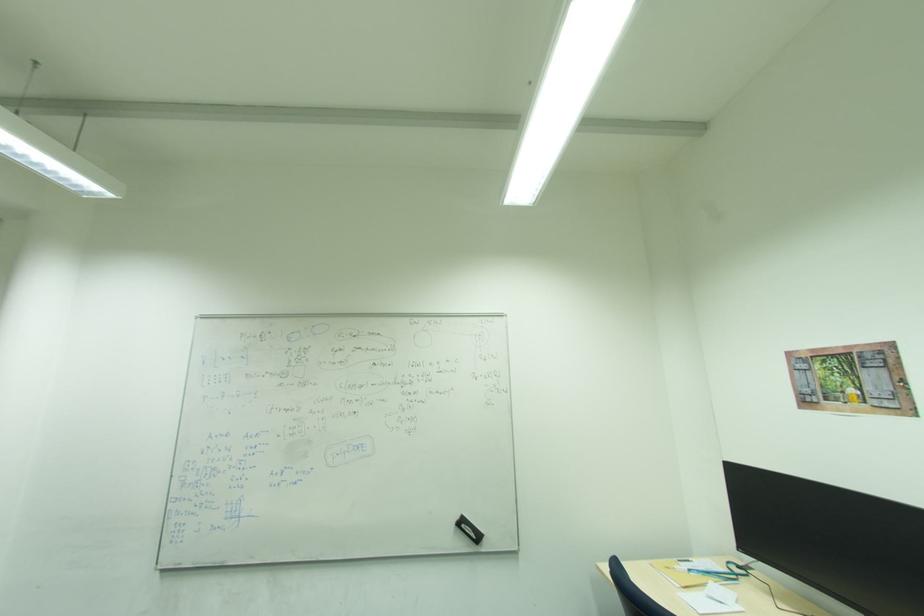
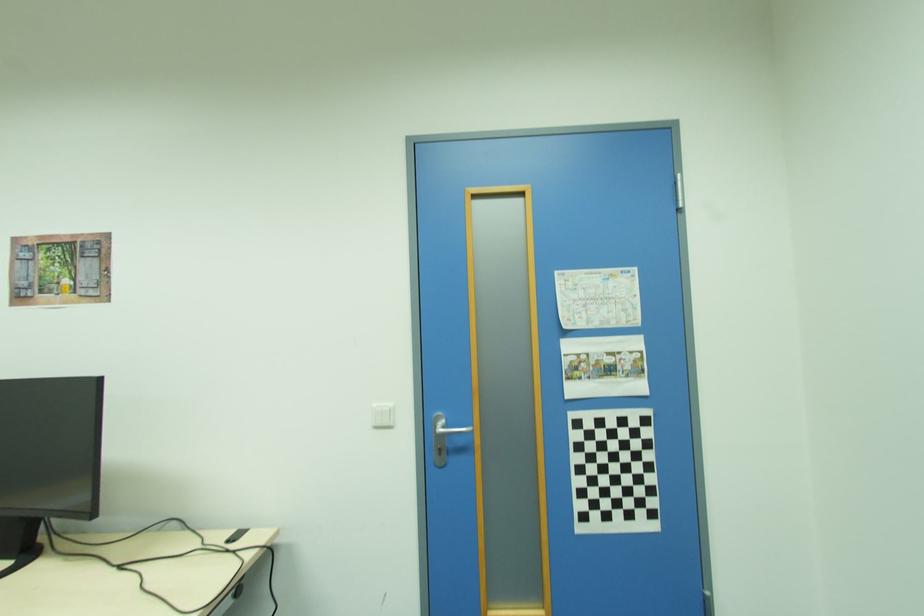
Question: How did the camera likely rotate?

Choices:
 (A) Left
 (B) Right
 (C) Up
 (D) Down

Answer: (B)